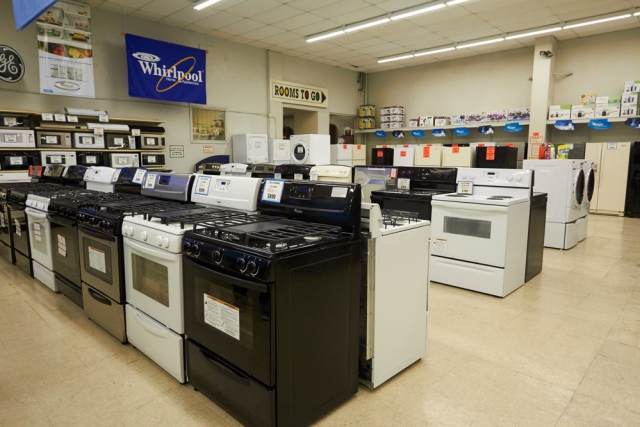
Where is `washer`? washer is located at coordinates (571, 205).